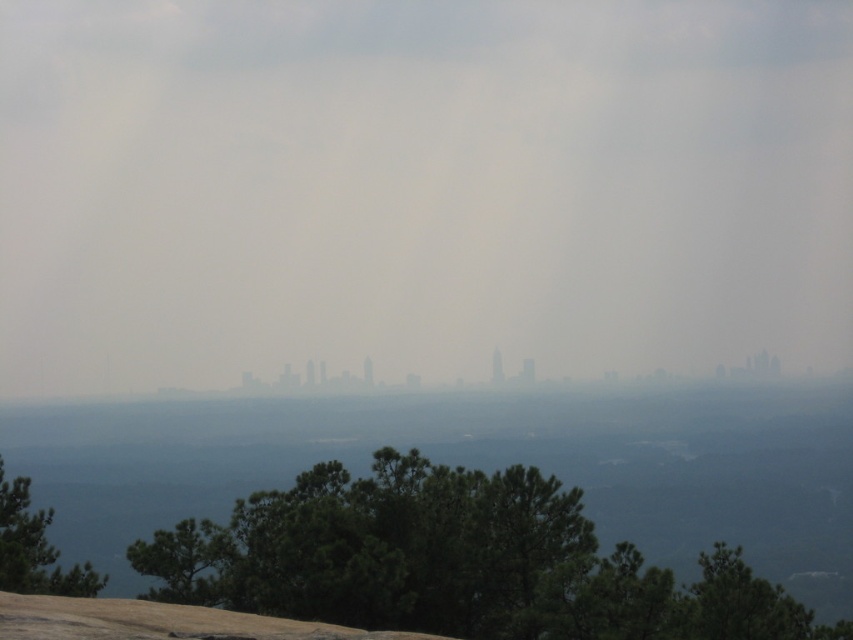
You are a landscape architect planning to plant a new tree between the green leafy tree at lower center and the green matte tree at lower left. The new tree requires at least 40 meters of space between existing trees. Based on the current spacing, will there be enough room?

The green leafy tree at lower center and green matte tree at lower left are 37.13 meters apart, which is less than the required 40 meters. Therefore, there is not enough space to plant the new tree between them.

You are an architect analyzing the cityscape. You need to place a new observation deck at the coordinates where the foggy sky at center is located. What coordinates should you use?

The coordinates for the foggy sky at center are 0.294 in the x and 0.492 in the y. So the architect should place the observation deck at point (419, 188).

You are standing at the point closer to the foreground. Which point are you at, point (440, 332) or point (459, 586)?

You are at point (459, 586) because it is closer to the foreground compared to point (440, 332) which is behind it.